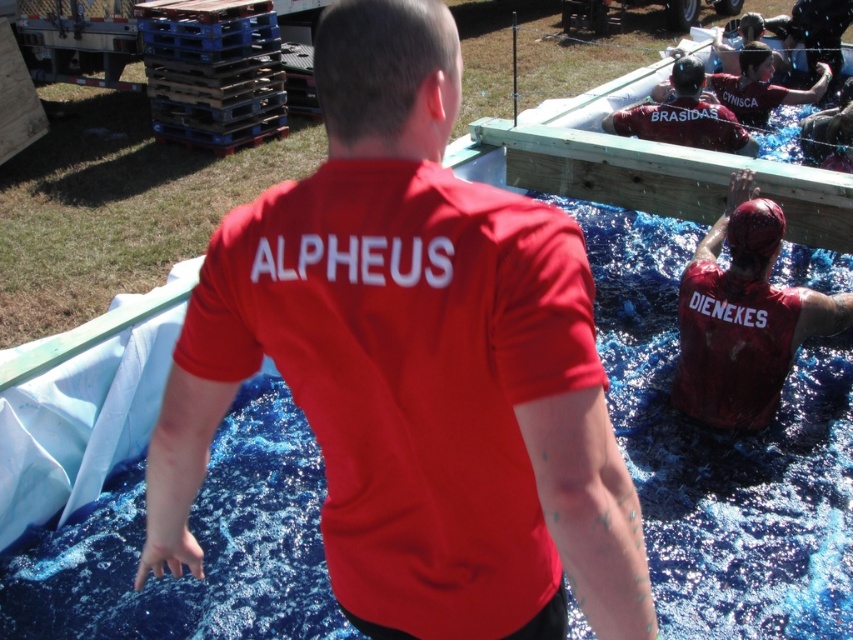
Question: Which is farther from the matte red shirt at upper right?

Choices:
 (A) matte red shirt at right
 (B) matte red shirt at center
 (C) matte red shirt at upper center

Answer: (B)

Question: Does matte red shirt at right have a greater width compared to matte red shirt at upper center?

Choices:
 (A) yes
 (B) no

Answer: (B)

Question: Among these objects, which one is nearest to the camera?

Choices:
 (A) matte red shirt at center
 (B) matte red shirt at upper center

Answer: (A)

Question: Which object is closer to the camera taking this photo?

Choices:
 (A) matte red shirt at upper center
 (B) matte red shirt at center

Answer: (B)

Question: Is matte red shirt at right to the right of matte red shirt at upper center from the viewer's perspective?

Choices:
 (A) yes
 (B) no

Answer: (B)

Question: Does matte red shirt at right come in front of matte red shirt at upper right?

Choices:
 (A) yes
 (B) no

Answer: (A)